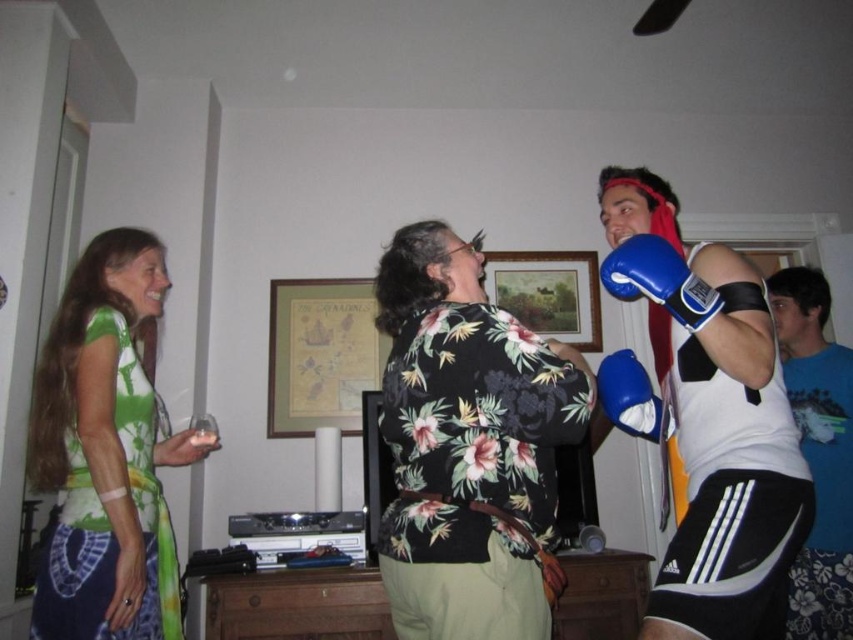
Question: Which point is farther from the camera taking this photo?

Choices:
 (A) (631, 262)
 (B) (616, 408)

Answer: (B)

Question: Which object is farther from the camera taking this photo?

Choices:
 (A) green tie-dye shirt at left
 (B) blue synthetic boxing glove at right
 (C) floral print shirt at center
 (D) blue synthetic boxing glove at upper right

Answer: (B)

Question: Which object appears farthest from the camera in this image?

Choices:
 (A) blue fabric shirt at right
 (B) blue synthetic boxing gloves at right

Answer: (A)

Question: Does floral print shirt at center have a greater width compared to blue synthetic boxing glove at upper right?

Choices:
 (A) no
 (B) yes

Answer: (B)

Question: Does blue synthetic boxing gloves at right have a larger size compared to green tie-dye shirt at left?

Choices:
 (A) yes
 (B) no

Answer: (B)

Question: Can you confirm if blue synthetic boxing glove at upper right is positioned below blue synthetic boxing glove at right?

Choices:
 (A) no
 (B) yes

Answer: (A)